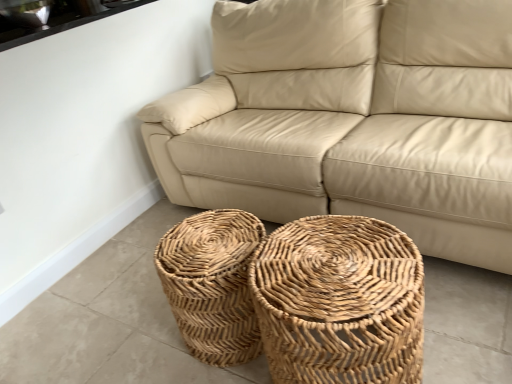
What is the approximate width of natural woven basket at center, the 1th basket viewed from the right?

The width of natural woven basket at center, the 1th basket viewed from the right, is 18.02 inches.

What do you see at coordinates (212, 284) in the screenshot?
I see `natural woven baskets at center, which is counted as the first basket, starting from the left` at bounding box center [212, 284].

Identify the location of natural woven baskets at center, the 2th basket in the right-to-left sequence. The image size is (512, 384). (212, 284).

Locate an element on the screen. beige leather couch at center is located at coordinates pos(352,119).

Identify the location of white glossy window sill at upper left. (53, 17).

Can we say natural woven baskets at center, the 2th basket in the right-to-left sequence, lies outside white glossy window sill at upper left?

Yes, natural woven baskets at center, the 2th basket in the right-to-left sequence, is located beyond the bounds of white glossy window sill at upper left.

Considering the positions of objects natural woven baskets at center, which is counted as the first basket, starting from the left, and white glossy window sill at upper left in the image provided, who is more to the right, natural woven baskets at center, which is counted as the first basket, starting from the left, or white glossy window sill at upper left?

natural woven baskets at center, which is counted as the first basket, starting from the left.

From the image's perspective, is natural woven baskets at center, the 2th basket in the right-to-left sequence, on top of white glossy window sill at upper left?

No, from the image's perspective, natural woven baskets at center, the 2th basket in the right-to-left sequence, is not on top of white glossy window sill at upper left.

Is point (183, 291) farther from camera compared to point (27, 16)?

No, it is in front of (27, 16).

Would you consider beige leather couch at center to be distant from natural woven baskets at center, the 2th basket in the right-to-left sequence?

beige leather couch at center is near natural woven baskets at center, the 2th basket in the right-to-left sequence, not far away.

Is beige leather couch at center facing away from natural woven baskets at center, the 2th basket in the right-to-left sequence?

→ beige leather couch at center is not turned away from natural woven baskets at center, the 2th basket in the right-to-left sequence.

Between beige leather couch at center and natural woven baskets at center, the 2th basket in the right-to-left sequence, which one appears on the left side from the viewer's perspective?

From the viewer's perspective, natural woven baskets at center, the 2th basket in the right-to-left sequence, appears more on the left side.

How different are the orientations of beige leather couch at center and natural woven baskets at center, the 2th basket in the right-to-left sequence, in degrees?

The angular difference between beige leather couch at center and natural woven baskets at center, the 2th basket in the right-to-left sequence, is 1.86 degrees.

From a real-world perspective, between natural woven basket at center, positioned as the 2th basket in left-to-right order, and white glossy window sill at upper left, who is vertically lower?

natural woven basket at center, positioned as the 2th basket in left-to-right order.

Measure the distance between natural woven basket at center, the 1th basket viewed from the right, and white glossy window sill at upper left.

They are 1.59 meters apart.

Can you confirm if natural woven basket at center, positioned as the 2th basket in left-to-right order, is positioned to the left of white glossy window sill at upper left?

Incorrect, natural woven basket at center, positioned as the 2th basket in left-to-right order, is not on the left side of white glossy window sill at upper left.

Is natural woven basket at center, positioned as the 2th basket in left-to-right order, not within white glossy window sill at upper left?

Yes.

From a real-world perspective, relative to beige leather couch at center, is natural woven baskets at center, the 2th basket in the right-to-left sequence, vertically above or below?

natural woven baskets at center, the 2th basket in the right-to-left sequence, is situated lower than beige leather couch at center in the real world.

Is natural woven baskets at center, the 2th basket in the right-to-left sequence, positioned with its back to beige leather couch at center?

That's right, natural woven baskets at center, the 2th basket in the right-to-left sequence, is facing away from beige leather couch at center.

How different are the orientations of natural woven baskets at center, the 2th basket in the right-to-left sequence, and beige leather couch at center in degrees?

There is a 1.86-degree angle between the facing directions of natural woven baskets at center, the 2th basket in the right-to-left sequence, and beige leather couch at center.

Is natural woven baskets at center, the 2th basket in the right-to-left sequence, with beige leather couch at center?

natural woven baskets at center, the 2th basket in the right-to-left sequence, and beige leather couch at center are not in contact.

Find the location of a particular element. This screenshot has height=384, width=512. studio couch in front of the white glossy window sill at upper left is located at coordinates (352, 119).

Between white glossy window sill at upper left and beige leather couch at center, which one has smaller size?

white glossy window sill at upper left is smaller.

Does white glossy window sill at upper left appear on the right side of beige leather couch at center?

In fact, white glossy window sill at upper left is to the left of beige leather couch at center.

From a real-world perspective, is white glossy window sill at upper left physically located above or below beige leather couch at center?

In terms of real-world spatial position, white glossy window sill at upper left is above beige leather couch at center.

From the image's perspective, is beige leather couch at center located above natural woven basket at center, positioned as the 2th basket in left-to-right order?

Yes, from the image's perspective, beige leather couch at center is above natural woven basket at center, positioned as the 2th basket in left-to-right order.

In the scene shown: Considering the sizes of objects beige leather couch at center and natural woven basket at center, positioned as the 2th basket in left-to-right order, in the image provided, who is shorter, beige leather couch at center or natural woven basket at center, positioned as the 2th basket in left-to-right order,?

natural woven basket at center, positioned as the 2th basket in left-to-right order.

Is there a large distance between beige leather couch at center and natural woven basket at center, the 1th basket viewed from the right?

No, beige leather couch at center is not far from natural woven basket at center, the 1th basket viewed from the right.

Is point (354, 193) farther from viewer compared to point (404, 327)?

That is True.

Can you confirm if white glossy window sill at upper left is taller than natural woven basket at center, positioned as the 2th basket in left-to-right order?

No.

From the image's perspective, between white glossy window sill at upper left and natural woven basket at center, positioned as the 2th basket in left-to-right order, which one is located above?

From the image's view, white glossy window sill at upper left is above.

Is white glossy window sill at upper left closer to the viewer compared to natural woven basket at center, the 1th basket viewed from the right?

No, white glossy window sill at upper left is further to the viewer.

From a real-world perspective, which is physically above, white glossy window sill at upper left or natural woven basket at center, the 1th basket viewed from the right?

From a 3D spatial view, white glossy window sill at upper left is above.

In order to click on the 1st basket in front when counting from the white glossy window sill at upper left in this screenshot , I will do `click(212, 284)`.

Locate an element on the screen. the 2nd basket below the beige leather couch at center (from a real-world perspective) is located at coordinates (212, 284).

Based on their spatial positions, is natural woven baskets at center, which is counted as the first basket, starting from the left, or white glossy window sill at upper left closer to beige leather couch at center?

Based on the image, natural woven baskets at center, which is counted as the first basket, starting from the left, appears to be nearer to beige leather couch at center.

When comparing their distances from beige leather couch at center, does white glossy window sill at upper left or natural woven baskets at center, the 2th basket in the right-to-left sequence, seem closer?

Based on the image, natural woven baskets at center, the 2th basket in the right-to-left sequence, appears to be nearer to beige leather couch at center.

Considering their positions, is beige leather couch at center positioned further to white glossy window sill at upper left than natural woven basket at center, the 1th basket viewed from the right?

natural woven basket at center, the 1th basket viewed from the right.

From the image, which object appears to be farther from beige leather couch at center, natural woven baskets at center, the 2th basket in the right-to-left sequence, or natural woven basket at center, positioned as the 2th basket in left-to-right order?

natural woven baskets at center, the 2th basket in the right-to-left sequence, is positioned further to the anchor beige leather couch at center.

Estimate the real-world distances between objects in this image. Which object is closer to natural woven basket at center, positioned as the 2th basket in left-to-right order, natural woven baskets at center, the 2th basket in the right-to-left sequence, or white glossy window sill at upper left?

natural woven baskets at center, the 2th basket in the right-to-left sequence.

In the scene shown: Estimate the real-world distances between objects in this image. Which object is further from natural woven basket at center, positioned as the 2th basket in left-to-right order, white glossy window sill at upper left or natural woven baskets at center, the 2th basket in the right-to-left sequence?

The object further to natural woven basket at center, positioned as the 2th basket in left-to-right order, is white glossy window sill at upper left.

Considering their positions, is natural woven baskets at center, the 2th basket in the right-to-left sequence, positioned further to white glossy window sill at upper left than natural woven basket at center, positioned as the 2th basket in left-to-right order?

natural woven basket at center, positioned as the 2th basket in left-to-right order, is further to white glossy window sill at upper left.

Looking at the image, which one is located closer to natural woven basket at center, the 1th basket viewed from the right, beige leather couch at center or white glossy window sill at upper left?

beige leather couch at center lies closer to natural woven basket at center, the 1th basket viewed from the right, than the other object.

Identify the location of basket between white glossy window sill at upper left and natural woven basket at center, the 1th basket viewed from the right, in the vertical direction. (212, 284).

Where is `basket between beige leather couch at center and natural woven basket at center, the 1th basket viewed from the right, in the up-down direction`? The width and height of the screenshot is (512, 384). basket between beige leather couch at center and natural woven basket at center, the 1th basket viewed from the right, in the up-down direction is located at coordinates coord(212,284).

Image resolution: width=512 pixels, height=384 pixels. I want to click on studio couch between white glossy window sill at upper left and natural woven baskets at center, the 2th basket in the right-to-left sequence, in the up-down direction, so click(x=352, y=119).